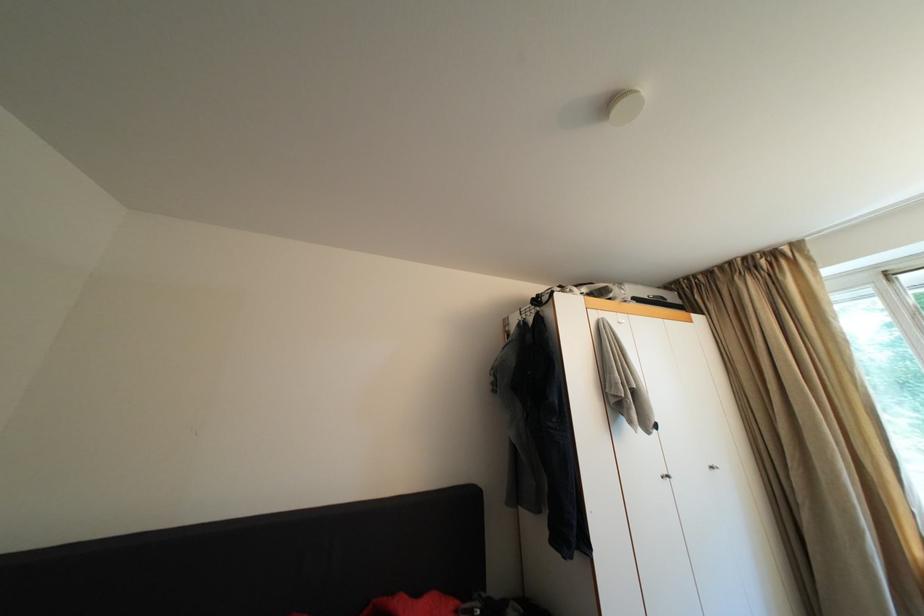
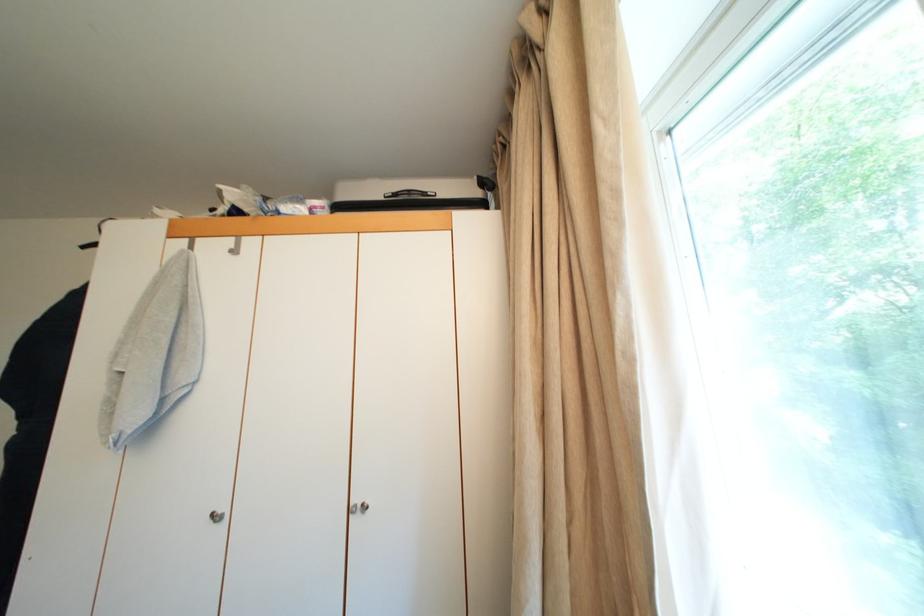
In a continuous first-person perspective shot, in which direction is the camera moving?

The cameraman moved toward right, forward.